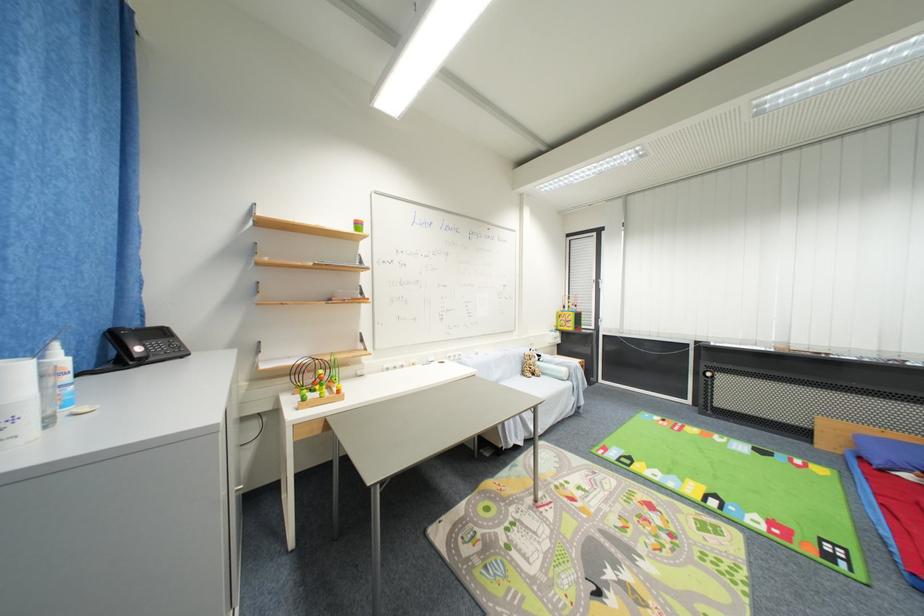
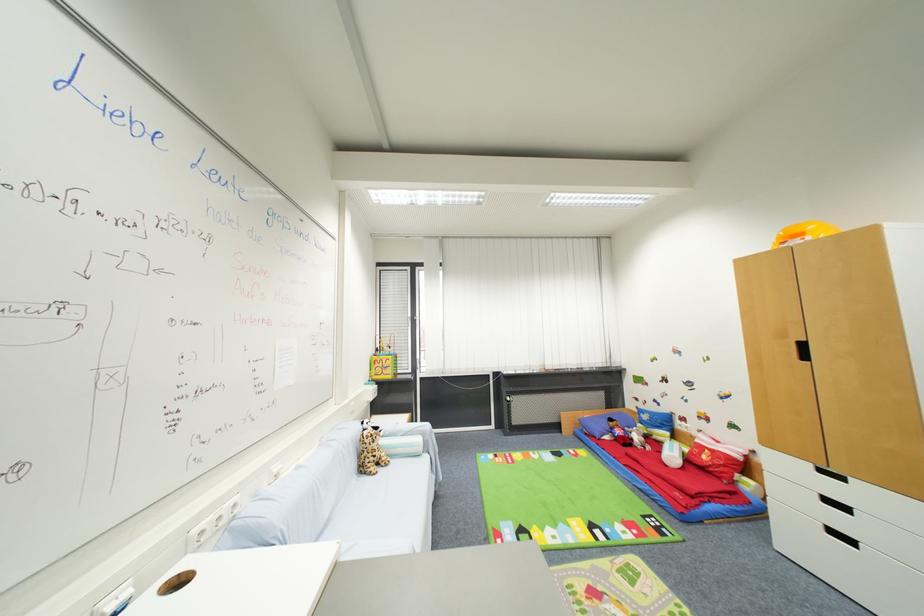
In the second image, find the point that corresponds to pixel 892 535 in the first image.

(650, 488)